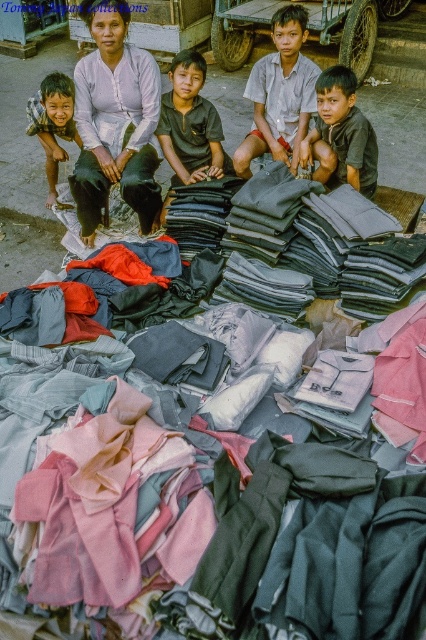
Question: Among these objects, which one is nearest to the camera?

Choices:
 (A) dark gray cotton shirt at center
 (B) matte white blouse at center

Answer: (B)

Question: Which of the following is the farthest from the observer?

Choices:
 (A) (180, 150)
 (B) (347, 129)

Answer: (A)

Question: Is dark brown cotton shirt at center further to the viewer compared to pink fabric at lower left?

Choices:
 (A) yes
 (B) no

Answer: (B)

Question: Can you confirm if white cotton shirt at center is positioned to the right of dark brown cotton shirt at center?

Choices:
 (A) no
 (B) yes

Answer: (A)

Question: From the image, what is the correct spatial relationship of dark brown cotton shirt at center in relation to pink fabric at lower left?

Choices:
 (A) right
 (B) left

Answer: (A)

Question: Which is farther from the dark gray cotton shirt at center?

Choices:
 (A) matte white blouse at center
 (B) matte black shirt at left
 (C) pink fabric at lower left
 (D) dark brown cotton shirt at center

Answer: (C)